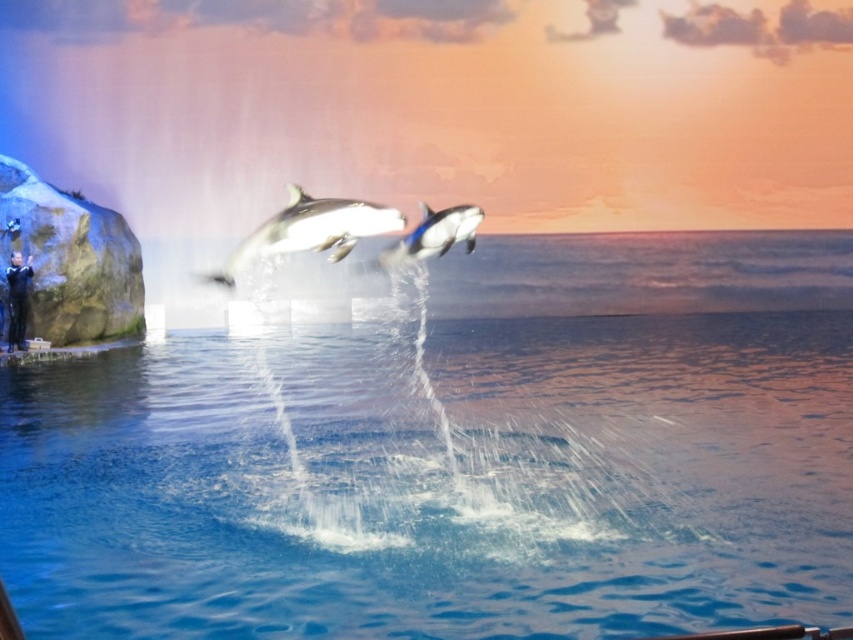
You are a dolphin trainer at the marine park. You need to throw a fish to the black smooth dolphin at center from your position at the black matte trainer at left. Can you reach it with a single throw if your maximum throwing distance is 15 meters?

The distance between the black smooth dolphin at center and the black matte trainer at left is 16.81 meters, which exceeds your maximum throwing distance of 15 meters. You cannot reach the dolphin with a single throw.

You are a photographer taking a picture of the two points in the marine show scene. Which point, point (228, 276) or point (451, 214), is closer to the camera?

Point (228, 276) is closer to the camera than point (451, 214).